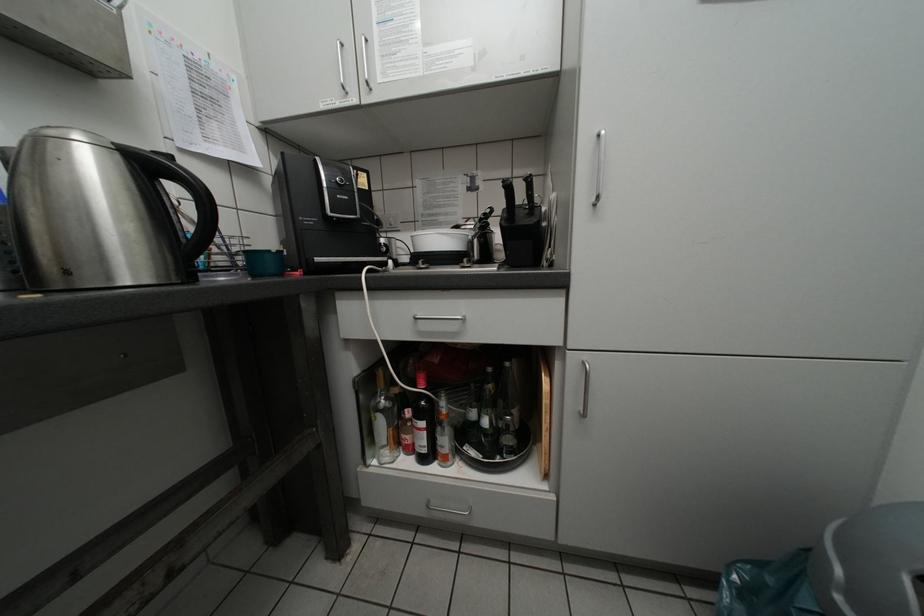
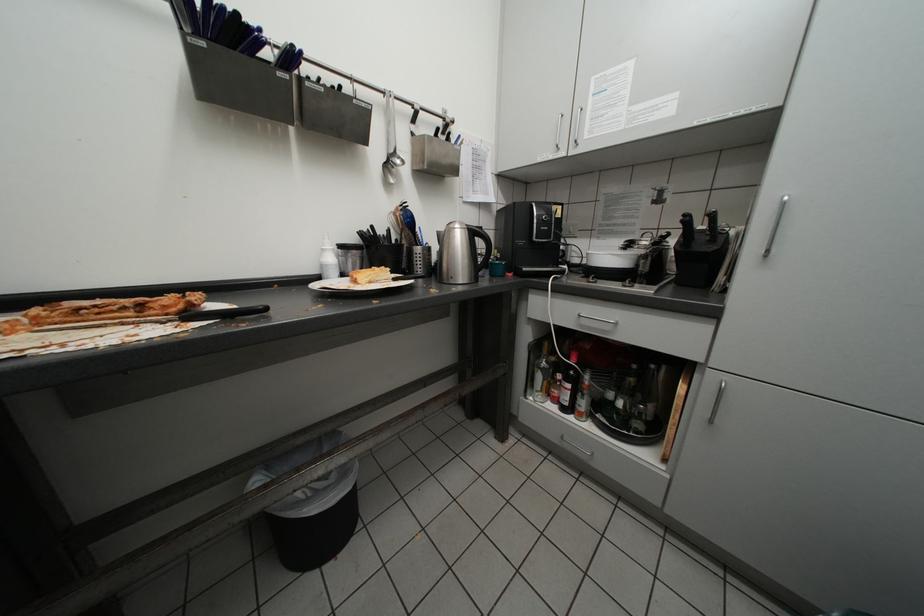
Question: The camera is either moving clockwise (left) or counter-clockwise (right) around the object. The first image is from the beginning of the video and the second image is from the end. Is the camera moving left or right when shooting the video?

Choices:
 (A) Left
 (B) Right

Answer: (B)